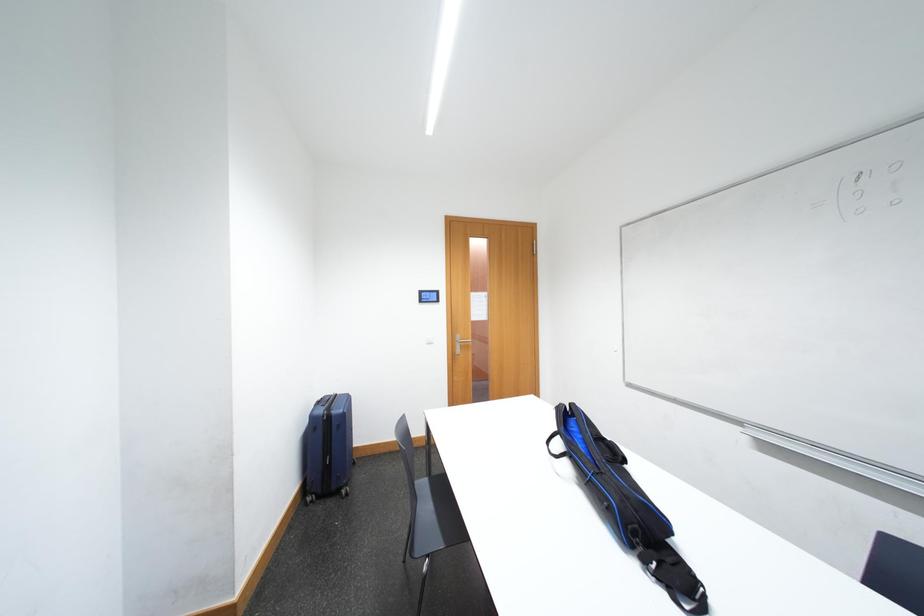
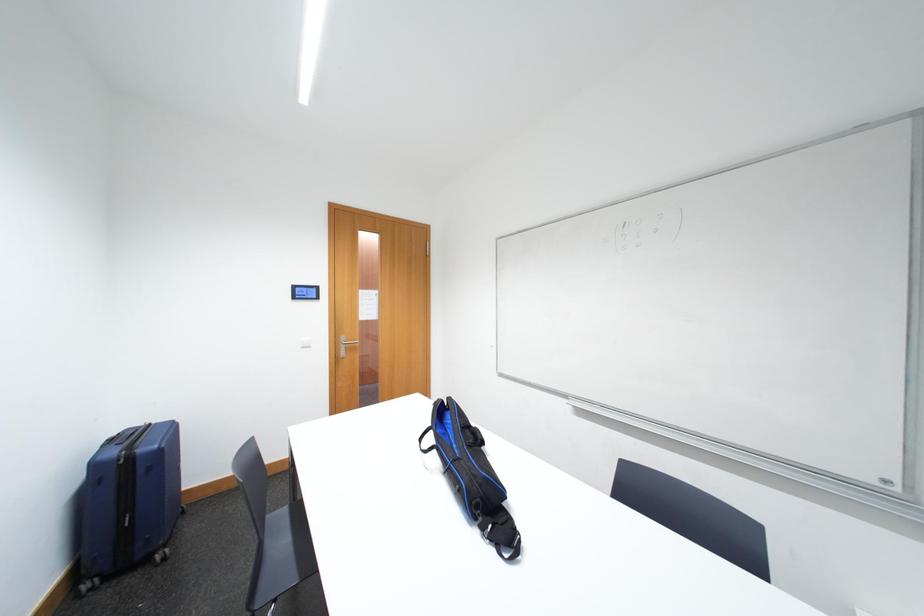
Question: The first image is from the beginning of the video and the second image is from the end. How did the camera likely rotate when shooting the video?

Choices:
 (A) Left
 (B) Right
 (C) Up
 (D) Down

Answer: (B)